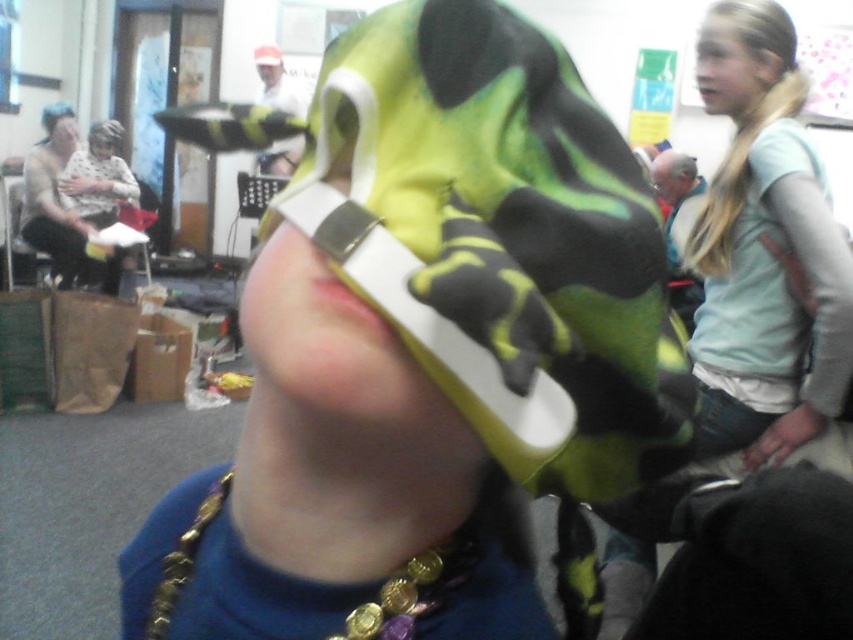
Question: Does gray fabric jacket at right appear under matte black helmet at center?

Choices:
 (A) no
 (B) yes

Answer: (B)

Question: Which object appears farthest from the camera in this image?

Choices:
 (A) matte black face at upper left
 (B) gold metallic necklace at center

Answer: (A)

Question: Based on their relative distances, which object is nearer to the gray fabric jacket at right?

Choices:
 (A) green camouflage hat at center
 (B) matte black shirt at left
 (C) gold metallic necklace at center
 (D) matte black face at upper left

Answer: (B)

Question: Which of the following is the closest to the observer?

Choices:
 (A) (177, 550)
 (B) (567, 106)
 (C) (677, 193)
 (D) (715, 38)

Answer: (B)

Question: Can you confirm if light blue fabric shirt at right is positioned to the right of matte black mask at upper center?

Choices:
 (A) yes
 (B) no

Answer: (B)

Question: Can you confirm if blonde hair at upper right is positioned below gray fabric jacket at right?

Choices:
 (A) no
 (B) yes

Answer: (B)